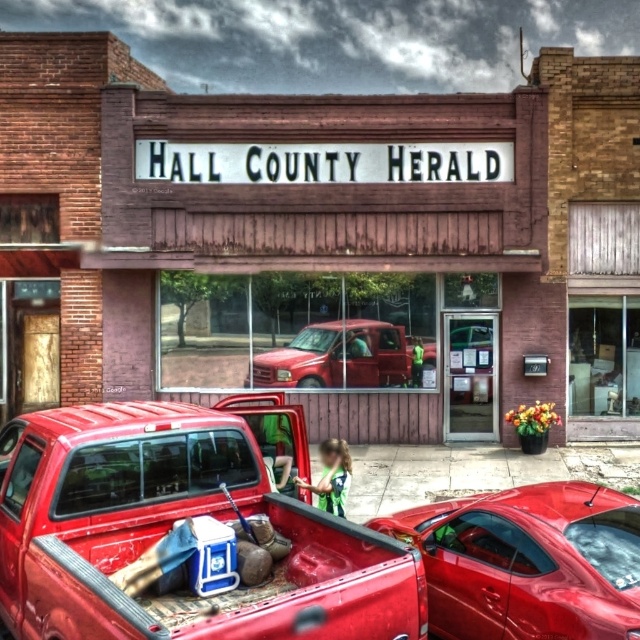
In the scene shown: You are a delivery person who needs to park your vehicle in front of the HALL COUNTY HERALD building. The wooden signboard at center is in your way. Can you move your truck forward so that the matte red truck at center doesn not block the signboard?

The wooden signboard at center is smaller than the matte red truck at center, so moving the truck forward might not prevent it from blocking the signboard since the truck is larger. You may need to adjust the parking position to ensure the signboard remains visible.

You are standing next to the glossy red car at center and want to take a photo of the HALL COUNTY HERALD building. The camera you have can only focus on objects within 15 feet. Will you be able to take a clear photo of the building from your current position?

The glossy red car at center and camera are 17.28 feet apart from each other. Since the camera can only focus within 15 feet, you are 2.28 feet beyond the maximum range. Therefore, you won???t be able to take a clear photo of the building from your current position.